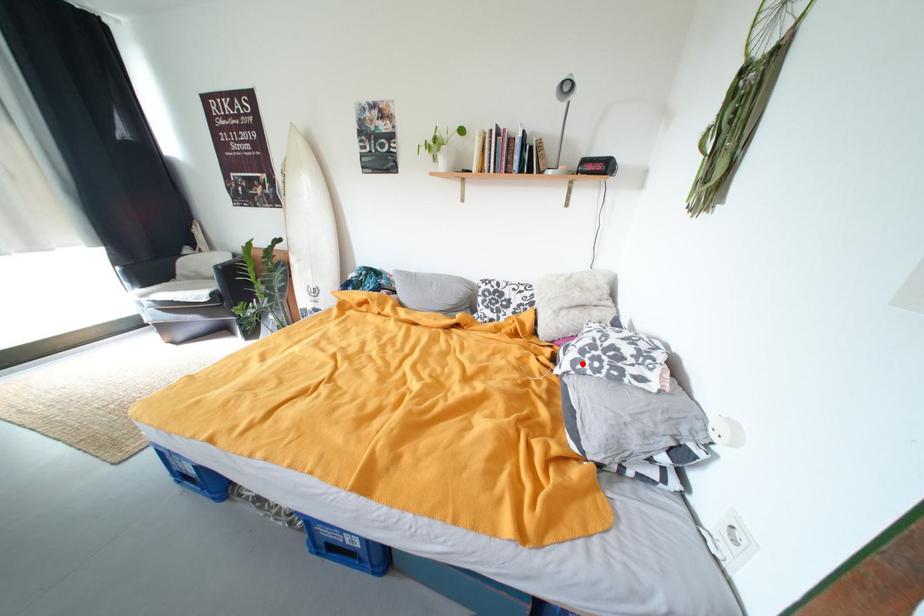
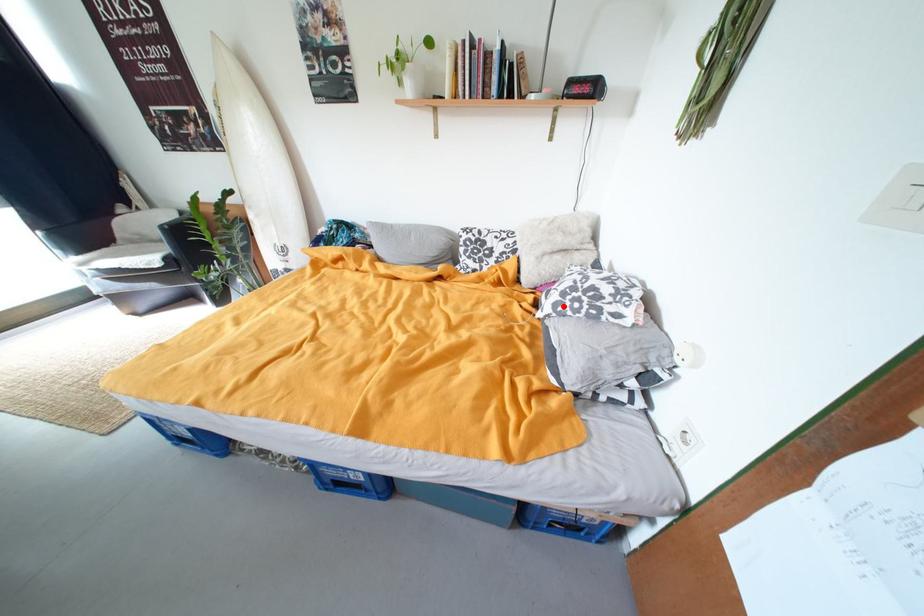
I am providing you with two images of the same scene from different viewpoints. A red point is marked on the first image and another point is marked on the second image. Is the marked point in image1 the same physical position as the marked point in image2?

Yes